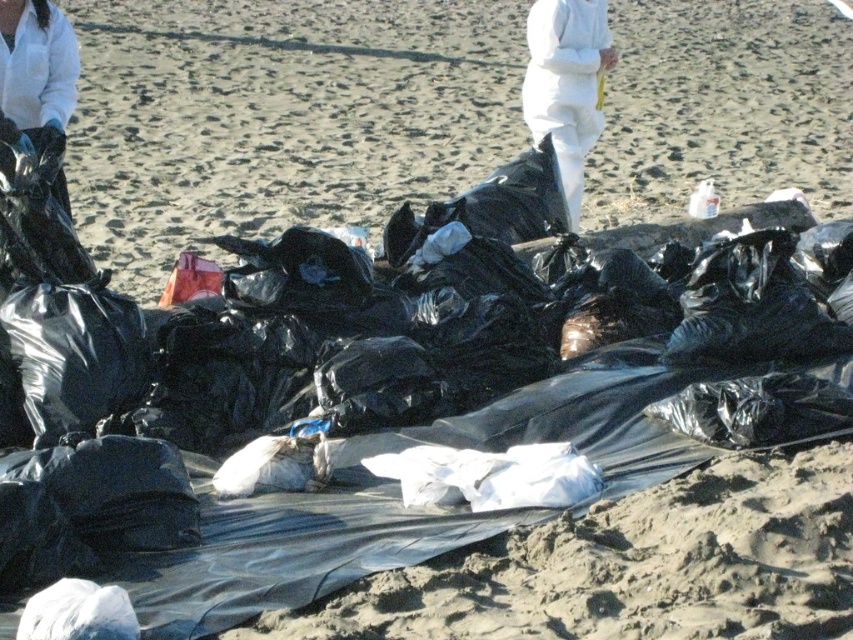
Question: Which point appears farthest from the camera in this image?

Choices:
 (A) (573, 230)
 (B) (25, 68)

Answer: (A)

Question: Can you confirm if white fuzzy pants at center is positioned below matte black gloves at upper left?

Choices:
 (A) no
 (B) yes

Answer: (A)

Question: Which of the following is the farthest from the observer?

Choices:
 (A) matte black gloves at upper left
 (B) white fuzzy pants at center

Answer: (B)

Question: Does white fuzzy pants at center lie in front of matte black gloves at upper left?

Choices:
 (A) yes
 (B) no

Answer: (B)

Question: Which object is closer to the camera taking this photo?

Choices:
 (A) matte black gloves at upper left
 (B) white fuzzy pants at center

Answer: (A)

Question: Is white fuzzy pants at center wider than matte black gloves at upper left?

Choices:
 (A) yes
 (B) no

Answer: (A)